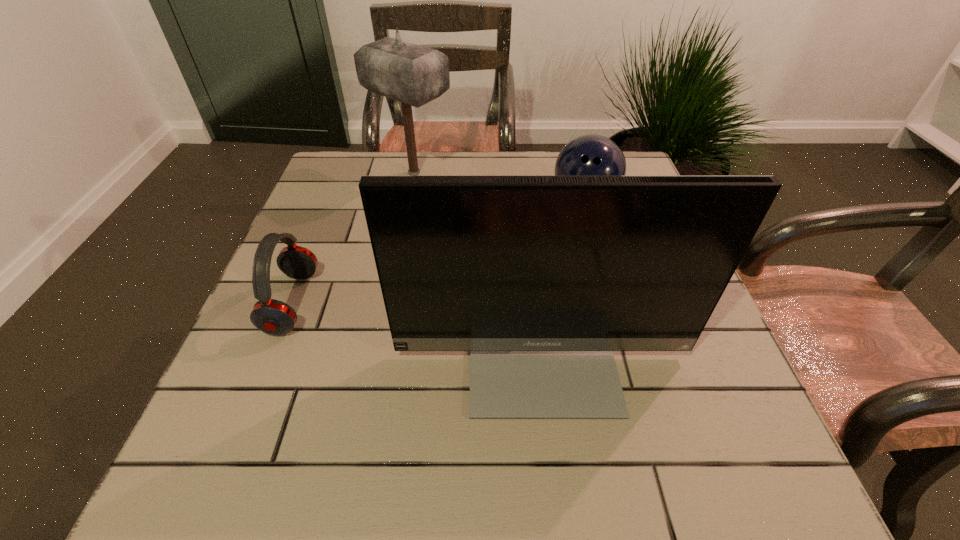
Find the location of a particular element. The image size is (960, 540). mallet that is at the left edge is located at coordinates (414, 75).

The width and height of the screenshot is (960, 540). In order to click on earphone present at the left edge in this screenshot , I will do `click(272, 316)`.

Find the location of `computer monitor that is positioned at the right edge`. computer monitor that is positioned at the right edge is located at coordinates (541, 278).

At what (x,y) coordinates should I click in order to perform the action: click on bowling ball present at the right edge. Please return your answer as a coordinate pair (x, y). The image size is (960, 540). Looking at the image, I should click on (589, 155).

You are a GUI agent. You are given a task and a screenshot of the screen. Output one action in this format:
    pyautogui.click(x=<x>, y=<y>)
    Task: Click on the object at the far left corner
    The image size is (960, 540).
    Given the screenshot: What is the action you would take?
    pyautogui.click(x=414, y=75)

The image size is (960, 540). I want to click on object located at the far right corner, so click(x=589, y=155).

You are a GUI agent. You are given a task and a screenshot of the screen. Output one action in this format:
    pyautogui.click(x=<x>, y=<y>)
    Task: Click on the free space at the far edge of the desktop
    Image resolution: width=960 pixels, height=540 pixels.
    Given the screenshot: What is the action you would take?
    pyautogui.click(x=427, y=158)

In the image, there is a desktop. Where is `vacant space at the left edge`? This screenshot has width=960, height=540. vacant space at the left edge is located at coordinates (299, 290).

In the image, there is a desktop. Where is `vacant space at the right edge`? vacant space at the right edge is located at coordinates (658, 399).

Where is `free space at the far left corner`? This screenshot has height=540, width=960. free space at the far left corner is located at coordinates (348, 164).